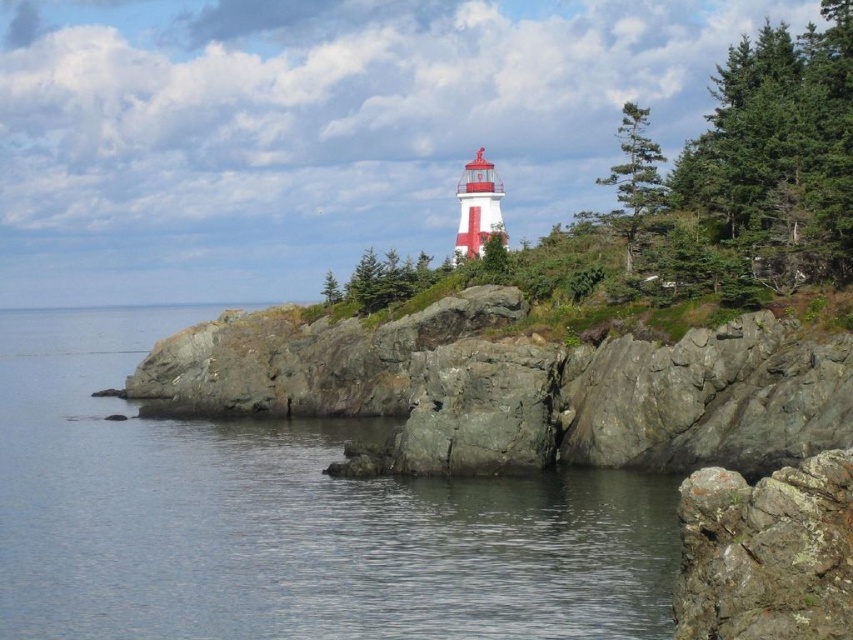
Does rusty rock at lower right have a lesser width compared to green textured tree at upper right?

Indeed, rusty rock at lower right has a lesser width compared to green textured tree at upper right.

In the scene shown: Measure the distance from rusty rock at lower right to green textured tree at upper right.

60.38 meters

The height and width of the screenshot is (640, 853). Identify the location of rusty rock at lower right. (766, 552).

In order to click on rusty rock at lower right in this screenshot , I will do `click(766, 552)`.

Can you confirm if transparent water at lower left is taller than green matte tree at upper right?

Incorrect, transparent water at lower left's height is not larger of green matte tree at upper right's.

Which of these two, transparent water at lower left or green matte tree at upper right, stands shorter?

Standing shorter between the two is transparent water at lower left.

Which is in front, point (198, 456) or point (793, 205)?

Point (793, 205)

I want to click on transparent water at lower left, so click(x=286, y=518).

Who is positioned more to the left, green matte tree at upper right or green textured tree at upper right?

green textured tree at upper right

Looking at this image, between green matte tree at upper right and green textured tree at upper right, which one has more height?

With more height is green matte tree at upper right.

Between point (735, 113) and point (630, 141), which one is positioned in front?

Positioned in front is point (630, 141).

What are the coordinates of `green matte tree at upper right` in the screenshot? It's located at (779, 152).